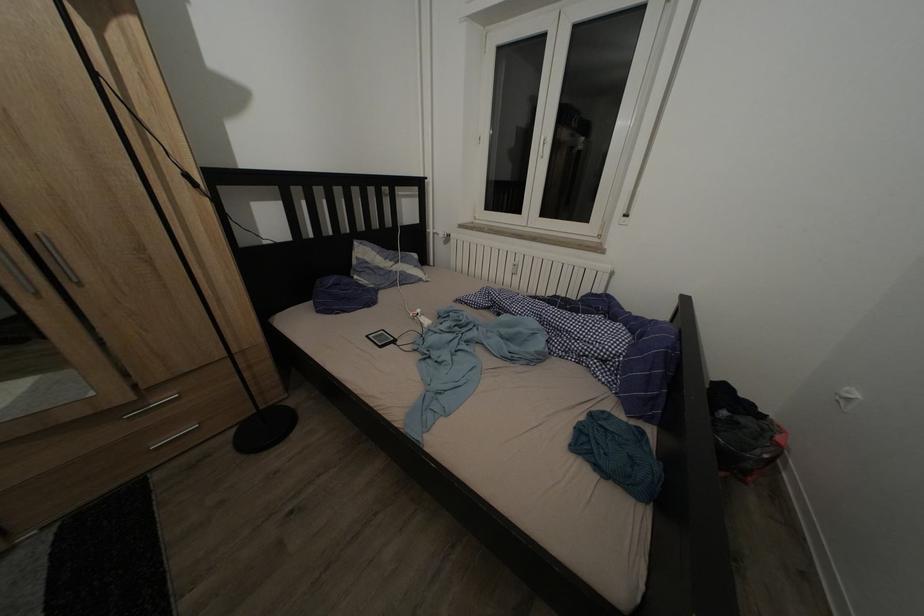
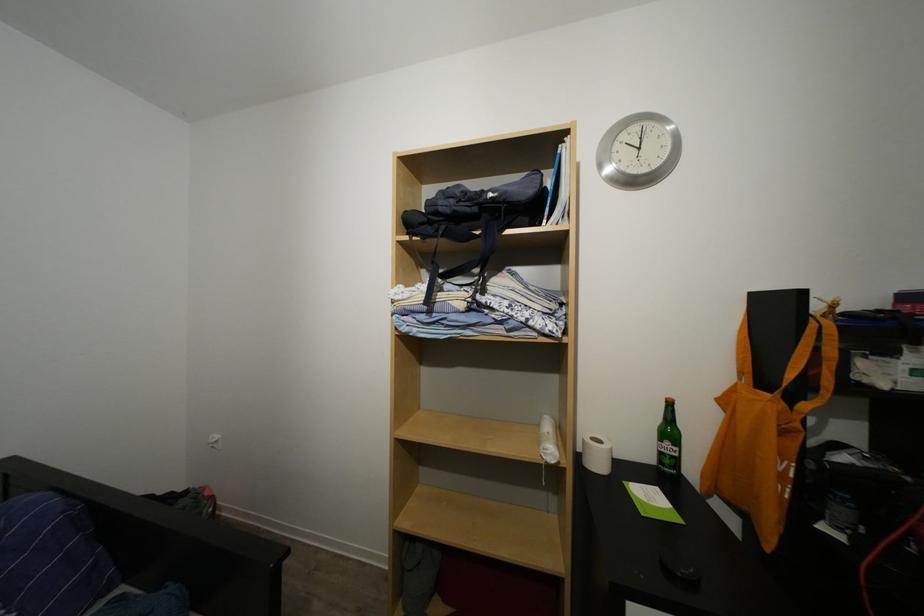
Question: How did the camera likely rotate?

Choices:
 (A) Left
 (B) Right
 (C) Up
 (D) Down

Answer: (B)